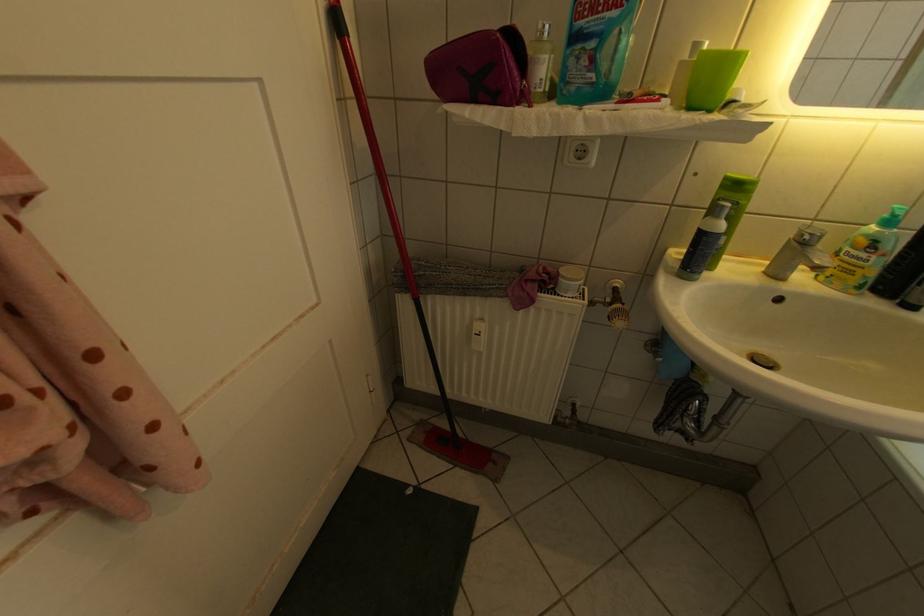
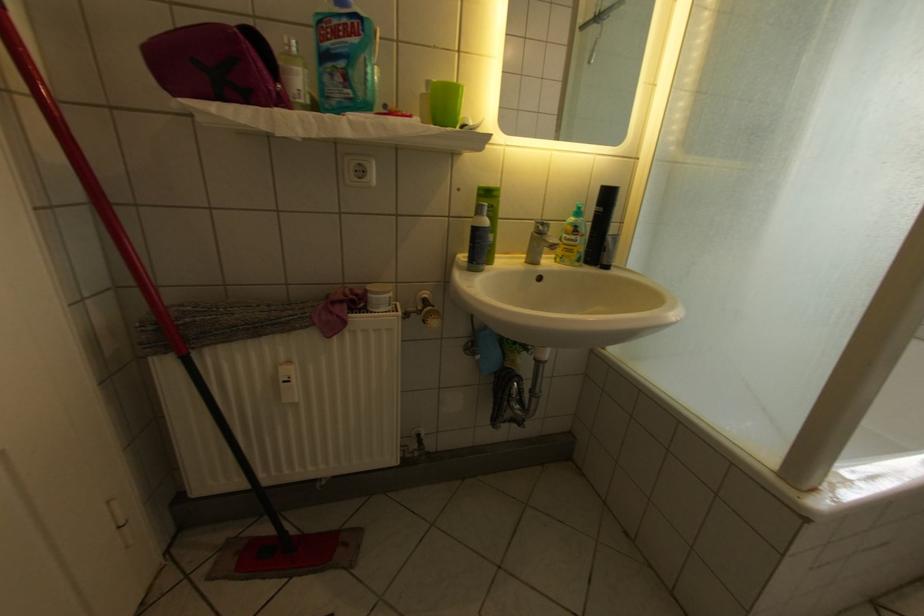
Find the pixel in the second image that matches point (564, 286) in the first image.

(374, 306)